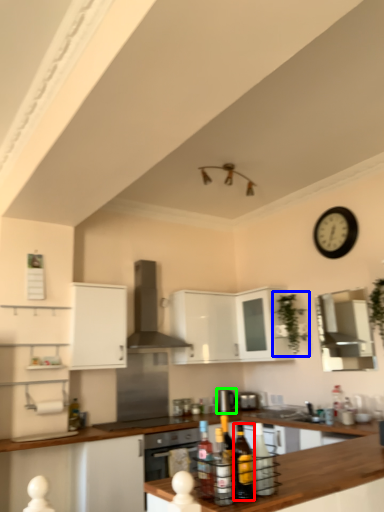
Question: Which is farther away from bottle (highlighted by a red box)? plant (highlighted by a blue box) or appliance (highlighted by a green box)?

Choices:
 (A) plant
 (B) appliance

Answer: (B)